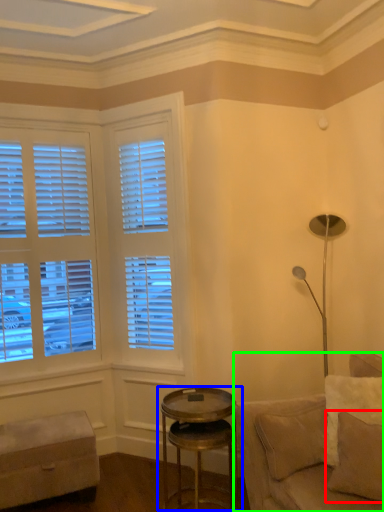
Question: Which is farther away from pillow (highlighted by a red box)? table (highlighted by a blue box) or studio couch (highlighted by a green box)?

Choices:
 (A) table
 (B) studio couch

Answer: (A)